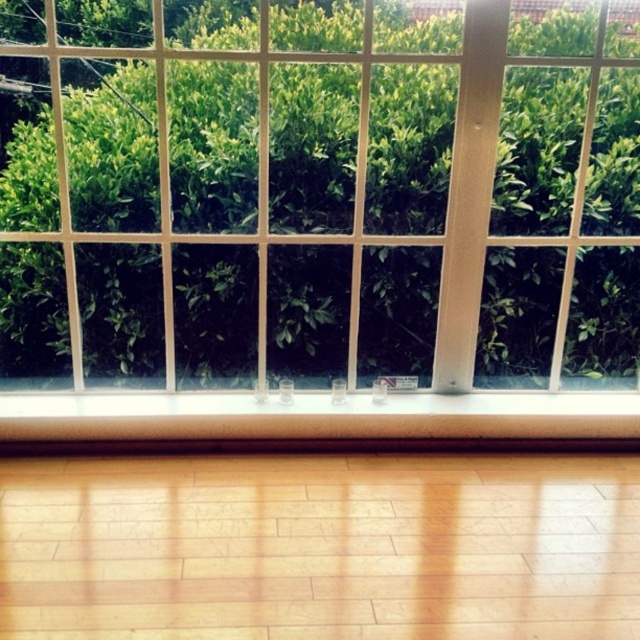
Which is in front, point (186, 292) or point (456, 444)?

Point (456, 444) is more forward.

Can you confirm if clear glass window at center is thinner than wooden at lower center?

No, clear glass window at center is not thinner than wooden at lower center.

Is point (230, 161) in front of point (168, 417)?

That is False.

This screenshot has width=640, height=640. Identify the location of clear glass window at center. (328, 205).